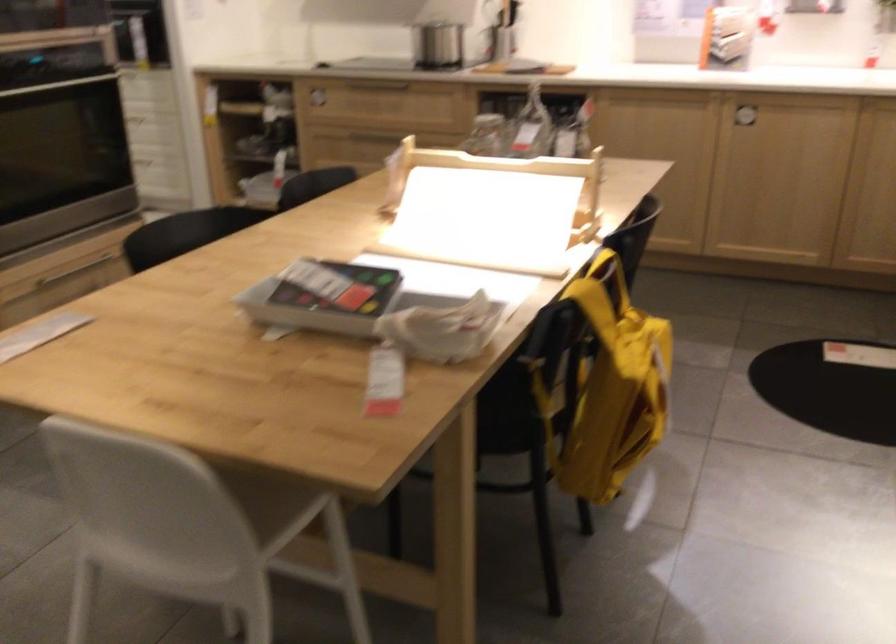
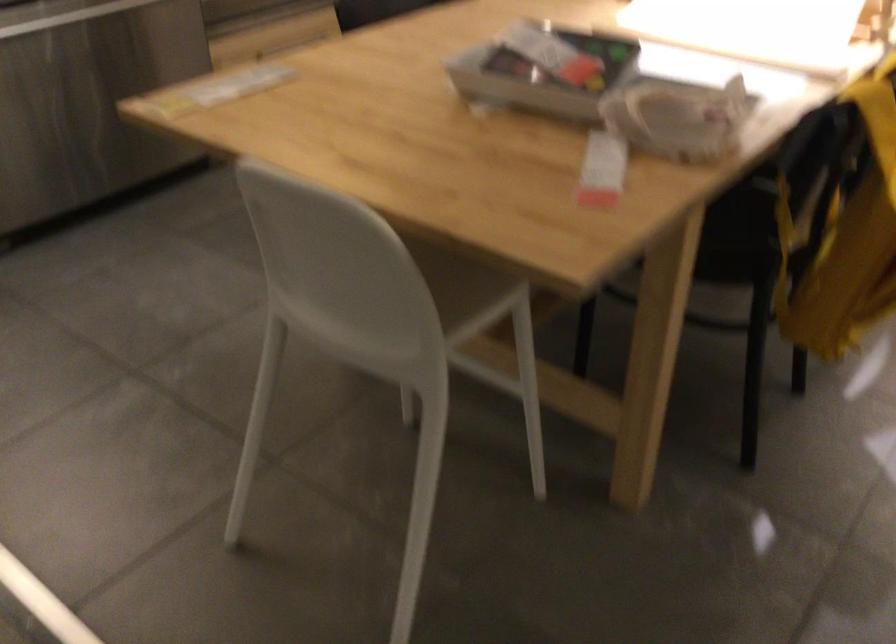
Question: The camera is either moving clockwise (left) or counter-clockwise (right) around the object. The first image is from the beginning of the video and the second image is from the end. Is the camera moving left or right when shooting the video?

Choices:
 (A) Left
 (B) Right

Answer: (B)